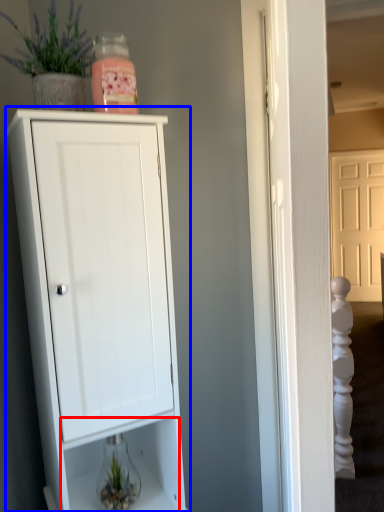
Question: Which of the following is the closest to the observer, drawer (highlighted by a red box) or cupboard (highlighted by a blue box)?

Choices:
 (A) drawer
 (B) cupboard

Answer: (B)